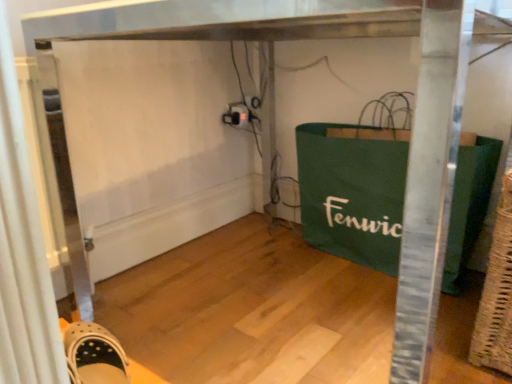
What do you see at coordinates (352, 193) in the screenshot?
I see `green paper bag at center` at bounding box center [352, 193].

At what (x,y) coordinates should I click in order to perform the action: click on green paper bag at center. Please return your answer as a coordinate pair (x, y). Looking at the image, I should click on pyautogui.click(x=352, y=193).

Identify the location of green paper bag at center. (352, 193).